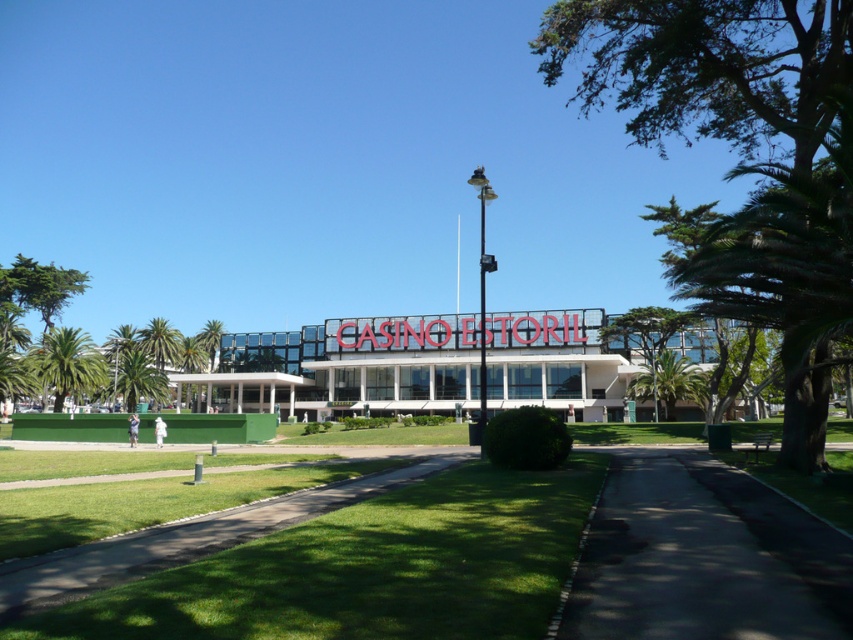
Can you confirm if green leafy palm tree at lower left is thinner than green leafy palm tree at center?

Yes.

Does point (125, 362) lie behind point (200, 342)?

No, (125, 362) is closer to viewer.

I want to click on green leafy palm tree at lower left, so click(x=138, y=380).

Locate an element on the screen. The width and height of the screenshot is (853, 640). green leafy palm tree at center-right is located at coordinates 669,381.

Is green leafy palm tree at center-right to the right of green leafy palm tree at lower left from the viewer's perspective?

Yes, green leafy palm tree at center-right is to the right of green leafy palm tree at lower left.

What do you see at coordinates (669, 381) in the screenshot? This screenshot has height=640, width=853. I see `green leafy palm tree at center-right` at bounding box center [669, 381].

Image resolution: width=853 pixels, height=640 pixels. I want to click on green leafy palm tree at center-right, so click(669, 381).

Who is lower down, green leafy palm tree at left or green leafy palm tree at center?

green leafy palm tree at left is below.

Is point (68, 353) closer to viewer compared to point (218, 328)?

Yes, it is in front of point (218, 328).

Find the location of `green leafy palm tree at left`. green leafy palm tree at left is located at coordinates (68, 364).